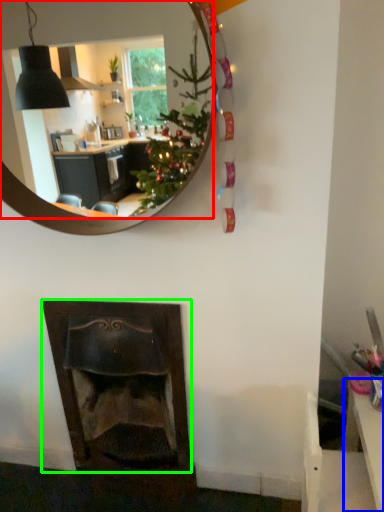
Question: Which object is the farthest from mirror (highlighted by a red box)? Choose among these: table (highlighted by a blue box) or fireplace (highlighted by a green box).

Choices:
 (A) table
 (B) fireplace

Answer: (A)